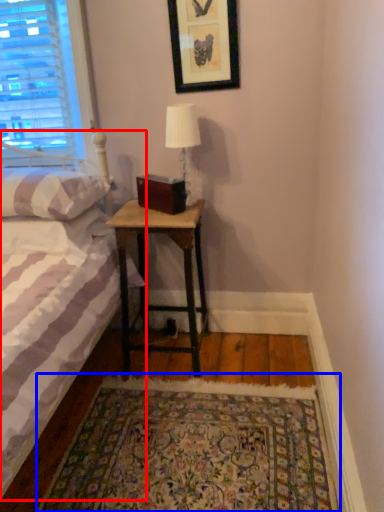
Question: Which object is further to the camera taking this photo, bed (highlighted by a red box) or mat (highlighted by a blue box)?

Choices:
 (A) bed
 (B) mat

Answer: (B)